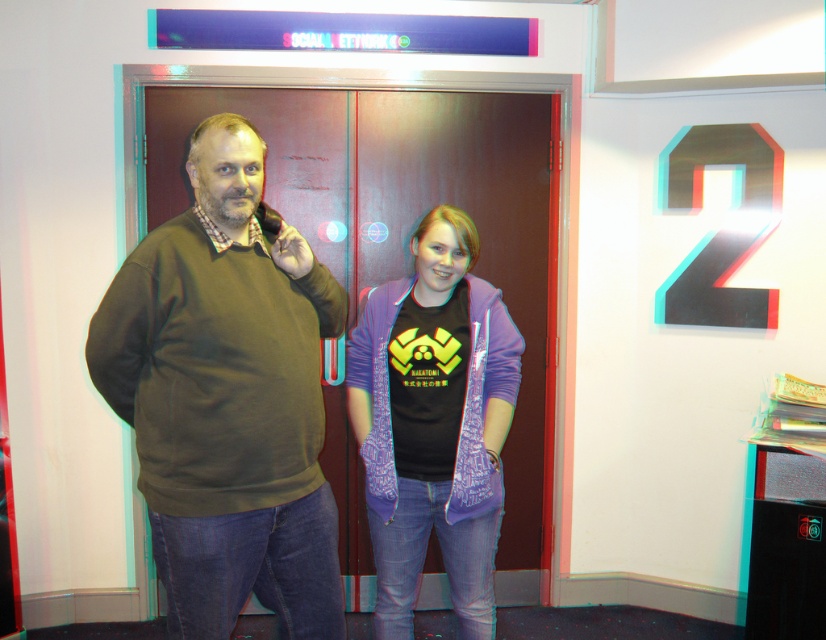
Is point (240, 396) closer to viewer compared to point (472, 611)?

Yes, it is.

Is matte green sweater at center further to camera compared to purple cotton jacket at center?

No, matte green sweater at center is in front of purple cotton jacket at center.

Between point (212, 572) and point (430, 524), which one is positioned in front?

Positioned in front is point (212, 572).

At what (x,y) coordinates should I click in order to perform the action: click on matte green sweater at center. Please return your answer as a coordinate pair (x, y). Image resolution: width=826 pixels, height=640 pixels. Looking at the image, I should click on (226, 397).